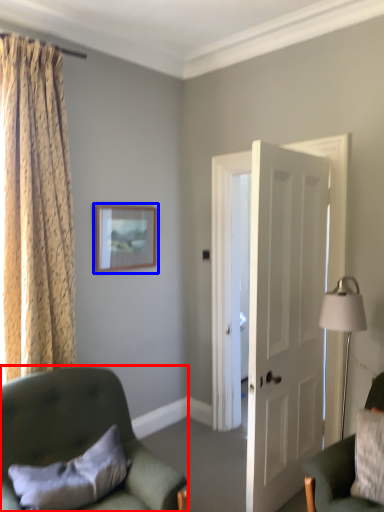
Question: Among these objects, which one is farthest to the camera, chair (highlighted by a red box) or picture frame (highlighted by a blue box)?

Choices:
 (A) chair
 (B) picture frame

Answer: (B)